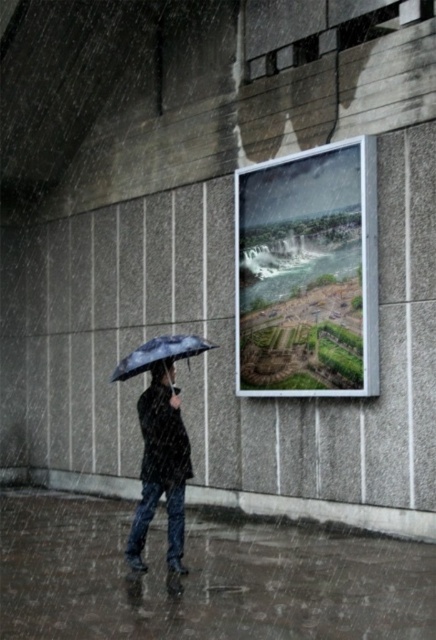
You are a pedestrian trying to decide which umbrella to use to stay dry in the heavy rain. You have two options in the scene, the dark blue matte umbrella at center and the matte black umbrella at center. Which one would provide better coverage based on their sizes?

The matte black umbrella at center is wider than the dark blue matte umbrella at center, so it would provide better coverage in the heavy rain.

You are standing in the rainy scene and see both the dark blue matte umbrella at center and the matte black umbrella at center. Which umbrella is positioned lower in the image?

The dark blue matte umbrella at center is positioned lower than the matte black umbrella at center in the image.

Looking at this image, you are a pedestrian trying to cross the street while avoiding puddles. You have a dark blue matte umbrella at center. Where exactly should you position your umbrella to stay dry while walking from the current position to the crosswalk located at point [160,467]?

The dark blue matte umbrella at center should be positioned directly above the crosswalk located at point [160,467] to stay dry.